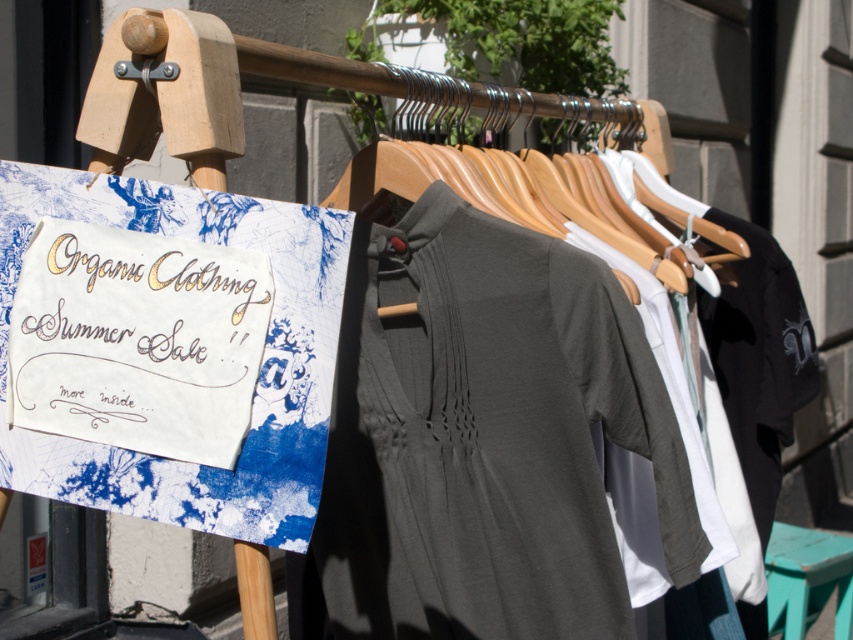
Is dark gray jersey dress at center further to the viewer compared to teal wood stool at lower right?

No, it is in front of teal wood stool at lower right.

Who is taller, dark gray jersey dress at center or teal wood stool at lower right?

Standing taller between the two is dark gray jersey dress at center.

This screenshot has height=640, width=853. Find the location of `dark gray jersey dress at center`. dark gray jersey dress at center is located at coordinates tap(485, 440).

Which is behind, point (415, 106) or point (766, 595)?

The point (766, 595) is more distant.

Image resolution: width=853 pixels, height=640 pixels. What do you see at coordinates (506, 196) in the screenshot?
I see `wooden hanger at center` at bounding box center [506, 196].

The width and height of the screenshot is (853, 640). I want to click on wooden hanger at center, so click(506, 196).

Who is positioned more to the left, dark gray jersey dress at center or gold calligraphy sign at upper left?

From the viewer's perspective, gold calligraphy sign at upper left appears more on the left side.

Does dark gray jersey dress at center appear on the right side of gold calligraphy sign at upper left?

Indeed, dark gray jersey dress at center is positioned on the right side of gold calligraphy sign at upper left.

Is point (672, 508) closer to viewer compared to point (73, 387)?

No, (672, 508) is further to viewer.

The image size is (853, 640). Find the location of `dark gray jersey dress at center`. dark gray jersey dress at center is located at coordinates (485, 440).